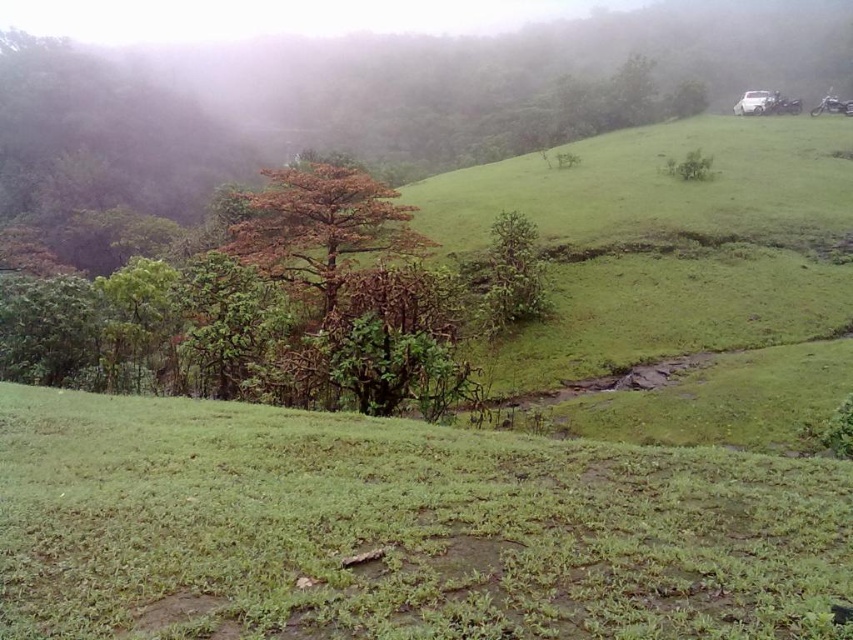
Looking at this image, you are standing at the point with coordinates (397, 529) in the image. What is the terrain like at that location?

The terrain at point (397, 529) is green grassy at lower center.